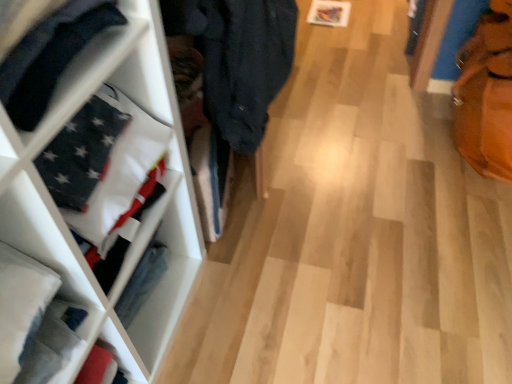
Question: Can you confirm if white fabric at left is taller than leather textured tote bag at right?

Choices:
 (A) no
 (B) yes

Answer: (A)

Question: Does white fabric at left appear on the right side of leather textured tote bag at right?

Choices:
 (A) yes
 (B) no

Answer: (B)

Question: Is white fabric at left with leather textured tote bag at right?

Choices:
 (A) yes
 (B) no

Answer: (B)

Question: Is white fabric at left at the left side of leather textured tote bag at right?

Choices:
 (A) yes
 (B) no

Answer: (A)

Question: Is white fabric at left looking in the opposite direction of leather textured tote bag at right?

Choices:
 (A) no
 (B) yes

Answer: (A)

Question: Is white fabric at left far from leather textured tote bag at right?

Choices:
 (A) no
 (B) yes

Answer: (B)

Question: From the image's perspective, is matte black flag at left under white fabric at left?

Choices:
 (A) no
 (B) yes

Answer: (A)

Question: Can you confirm if matte black flag at left is wider than white fabric at left?

Choices:
 (A) yes
 (B) no

Answer: (A)

Question: Is matte black flag at left bigger than white fabric at left?

Choices:
 (A) yes
 (B) no

Answer: (B)

Question: From a real-world perspective, is matte black flag at left positioned under white fabric at left based on gravity?

Choices:
 (A) yes
 (B) no

Answer: (B)

Question: Is matte black flag at left smaller than white fabric at left?

Choices:
 (A) no
 (B) yes

Answer: (B)

Question: From the image's perspective, is matte black flag at left on top of white fabric at left?

Choices:
 (A) no
 (B) yes

Answer: (B)

Question: From the image's perspective, is leather textured tote bag at right located beneath matte black flag at left?

Choices:
 (A) yes
 (B) no

Answer: (B)